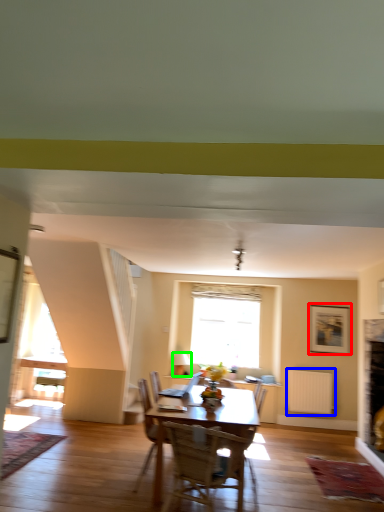
Question: Which object is positioned closest to picture frame (highlighted by a red box)? Select from radiator (highlighted by a blue box) and lamp (highlighted by a green box).

Choices:
 (A) radiator
 (B) lamp

Answer: (A)